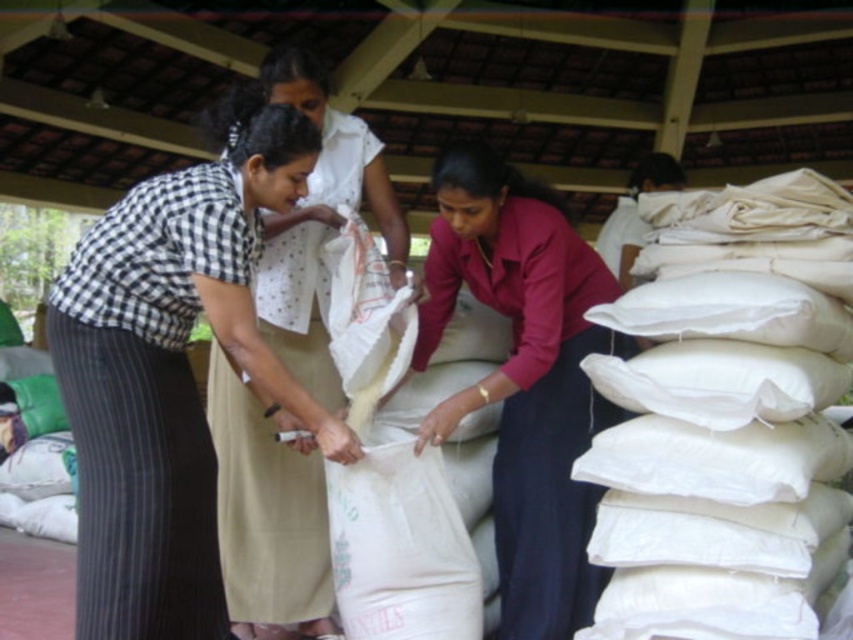
You are a worker in the warehouse and need to move the white matte sack at center to the front of the matte pink shirt at center. Is the sack currently positioned behind the shirt?

Yes, the white matte sack at center is currently positioned behind the matte pink shirt at center, so moving it to the front would require shifting its position.

You are a worker in the warehouse and need to lift the white matte sack at center. The safety guidelines state that you must be at least 18 inches away from any object to lift it safely. Can you lift the sack safely while standing at the position of the matte pink shirt at center?

The matte pink shirt at center is 16.71 inches away from the white matte sack at center, which is less than the required 18 inches for safe lifting. Therefore, you cannot lift the sack safely from that position.